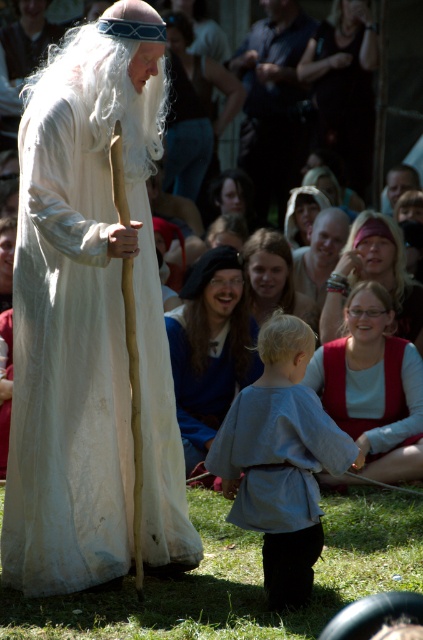
Does dark fabric handbag at upper center appear on the right side of smooth beige shirt at center?

Correct, you'll find dark fabric handbag at upper center to the right of smooth beige shirt at center.

Is point (343, 49) positioned before point (293, 266)?

No, it is behind (293, 266).

Locate an element on the screen. dark fabric handbag at upper center is located at coordinates (345, 84).

Is white linen robe at center bigger than red velvet vest at lower right?

Yes.

Who is shorter, white linen robe at center or red velvet vest at lower right?

Standing shorter between the two is red velvet vest at lower right.

Identify the location of white linen robe at center. (90, 321).

From the picture: Who is positioned more to the right, white cotton wig at center or dark blue shirt at center?

Positioned to the right is dark blue shirt at center.

Does point (120, 99) come farther from viewer compared to point (252, 129)?

That is False.

The width and height of the screenshot is (423, 640). Identify the location of white cotton wig at center. (107, 88).